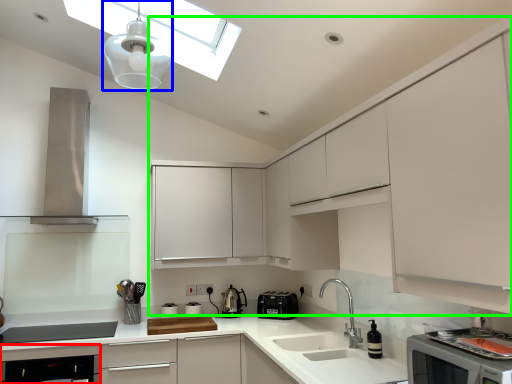
Question: Estimate the real-world distances between objects in this image. Which object is closer to dish washer (highlighted by a red box), light fixture (highlighted by a blue box) or cabinetry (highlighted by a green box)?

Choices:
 (A) light fixture
 (B) cabinetry

Answer: (B)